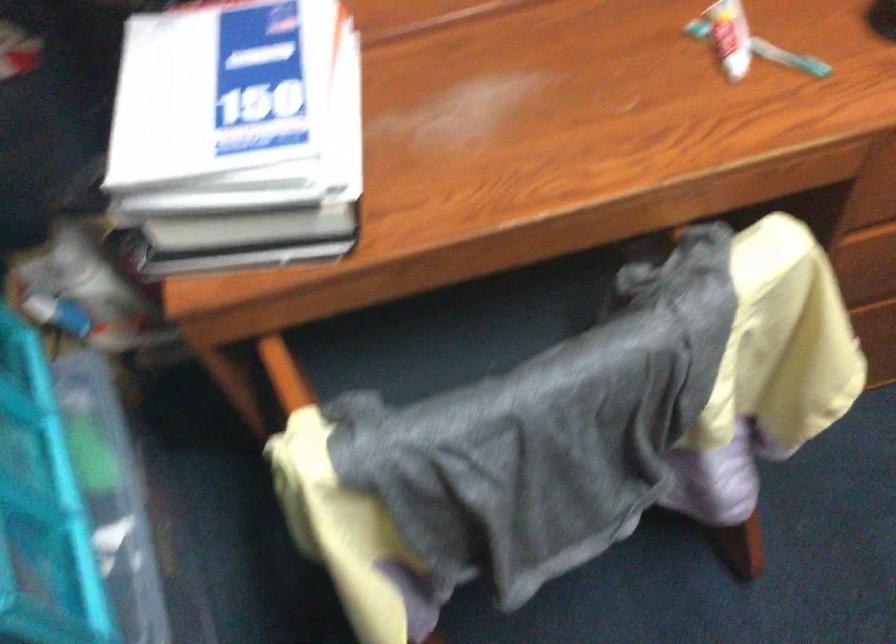
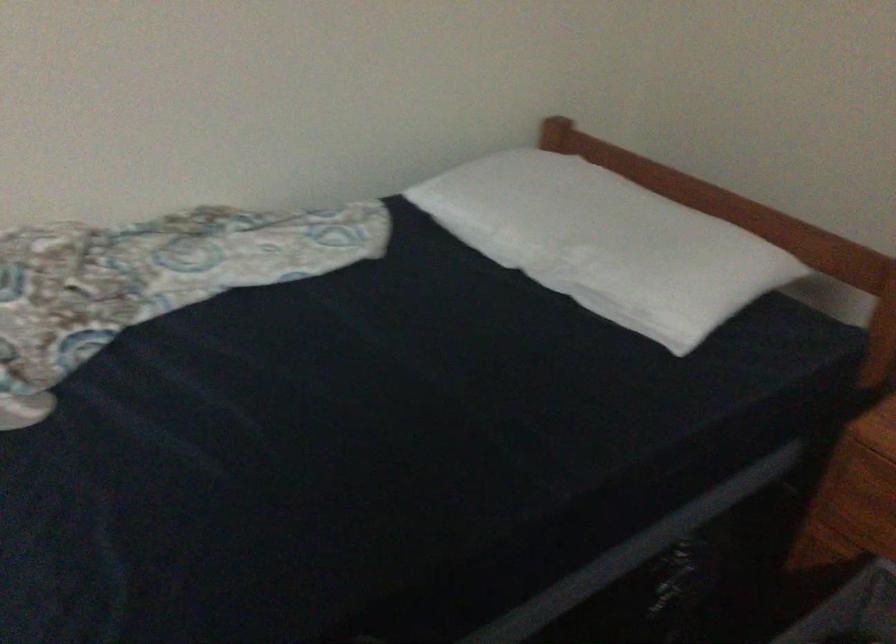
Question: How did the camera likely rotate?

Choices:
 (A) Left
 (B) Right
 (C) Up
 (D) Down

Answer: (A)